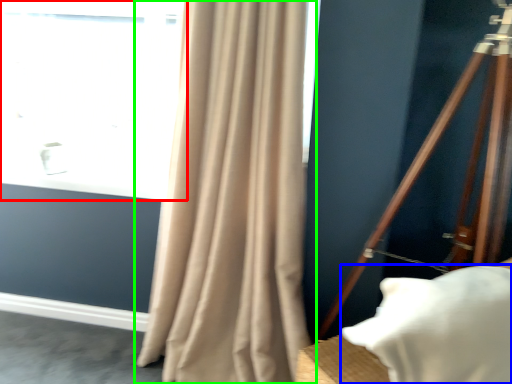
Question: Estimate the real-world distances between objects in this image. Which object is farther from window (highlighted by a red box), pillow (highlighted by a blue box) or curtain (highlighted by a green box)?

Choices:
 (A) pillow
 (B) curtain

Answer: (A)